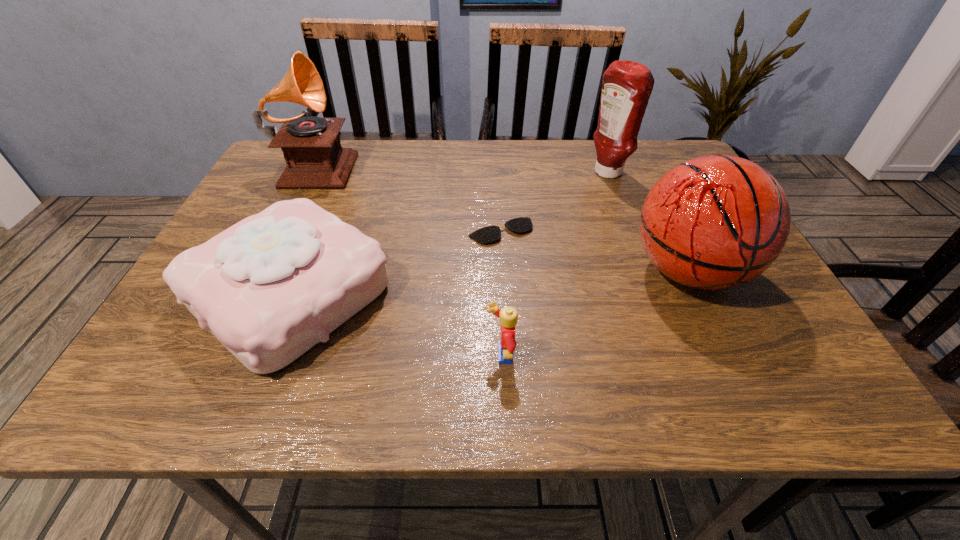
The height and width of the screenshot is (540, 960). Identify the location of free spot that satisfies the following two spatial constraints: 1. on the horn of the shortest object; 2. on the left side of the phonograph record. (282, 232).

I want to click on vacant position in the image that satisfies the following two spatial constraints: 1. on the front side of the condiment; 2. on the face of the fifth tallest object, so click(x=677, y=356).

Locate an element on the screen. vacant region that satisfies the following two spatial constraints: 1. on the horn of the phonograph record; 2. on the right side of the spectacles is located at coordinates (282, 232).

This screenshot has height=540, width=960. What are the coordinates of `blank space that satisfies the following two spatial constraints: 1. on the back side of the cake; 2. on the horn of the phonograph record` in the screenshot? It's located at (344, 164).

Where is `free point that satisfies the following two spatial constraints: 1. on the horn of the cake; 2. on the right side of the phonograph record`? This screenshot has height=540, width=960. free point that satisfies the following two spatial constraints: 1. on the horn of the cake; 2. on the right side of the phonograph record is located at coordinates (252, 293).

Where is `vacant point that satisfies the following two spatial constraints: 1. on the horn of the phonograph record; 2. on the right side of the shortest object`? The height and width of the screenshot is (540, 960). vacant point that satisfies the following two spatial constraints: 1. on the horn of the phonograph record; 2. on the right side of the shortest object is located at coordinates (282, 232).

You are a GUI agent. You are given a task and a screenshot of the screen. Output one action in this format:
    pyautogui.click(x=<x>, y=<y>)
    Task: Click on the vacant area in the image that satisfies the following two spatial constraints: 1. on the horn of the cake; 2. on the left side of the phonograph record
    This screenshot has width=960, height=540.
    Given the screenshot: What is the action you would take?
    [252, 293]

You are a GUI agent. You are given a task and a screenshot of the screen. Output one action in this format:
    pyautogui.click(x=<x>, y=<y>)
    Task: Click on the vacant space that satisfies the following two spatial constraints: 1. on the back side of the shortest object; 2. on the horn of the phonograph record
    This screenshot has height=540, width=960.
    Given the screenshot: What is the action you would take?
    (x=497, y=164)